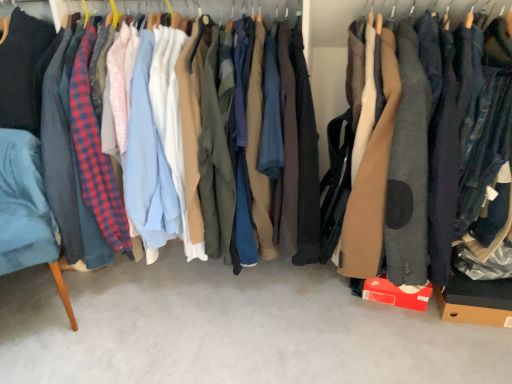
Question: Is brown cardboard box at lower right oriented away from matte brown coat at center?

Choices:
 (A) yes
 (B) no

Answer: (B)

Question: Can you confirm if brown cardboard box at lower right is thinner than matte brown coat at center?

Choices:
 (A) no
 (B) yes

Answer: (B)

Question: Does brown cardboard box at lower right have a smaller size compared to matte brown coat at center?

Choices:
 (A) yes
 (B) no

Answer: (A)

Question: From the image's perspective, does brown cardboard box at lower right appear lower than matte brown coat at center?

Choices:
 (A) yes
 (B) no

Answer: (A)

Question: Can you confirm if brown cardboard box at lower right is shorter than matte brown coat at center?

Choices:
 (A) no
 (B) yes

Answer: (B)

Question: Considering the positions of velvet blue armchair at left and brown cardboard box at lower right in the image, is velvet blue armchair at left bigger or smaller than brown cardboard box at lower right?

Choices:
 (A) small
 (B) big

Answer: (B)

Question: In the image, is velvet blue armchair at left positioned in front of or behind brown cardboard box at lower right?

Choices:
 (A) behind
 (B) front

Answer: (B)

Question: Visually, is velvet blue armchair at left positioned to the left or to the right of brown cardboard box at lower right?

Choices:
 (A) left
 (B) right

Answer: (A)

Question: From a real-world perspective, is velvet blue armchair at left above or below brown cardboard box at lower right?

Choices:
 (A) below
 (B) above

Answer: (B)

Question: Considering the positions of brown cardboard box at lower right and matte brown coat at center in the image, is brown cardboard box at lower right wider or thinner than matte brown coat at center?

Choices:
 (A) wide
 (B) thin

Answer: (B)

Question: Is brown cardboard box at lower right bigger or smaller than matte brown coat at center?

Choices:
 (A) small
 (B) big

Answer: (A)

Question: Is brown cardboard box at lower right inside or outside of matte brown coat at center?

Choices:
 (A) inside
 (B) outside

Answer: (B)

Question: Considering the positions of point (508, 286) and point (344, 249), is point (508, 286) closer or farther from the camera than point (344, 249)?

Choices:
 (A) closer
 (B) farther

Answer: (A)

Question: Is matte brown coat at center wider or thinner than matte black jacket at center?

Choices:
 (A) wide
 (B) thin

Answer: (A)

Question: In the image, is matte brown coat at center positioned in front of or behind matte black jacket at center?

Choices:
 (A) front
 (B) behind

Answer: (A)